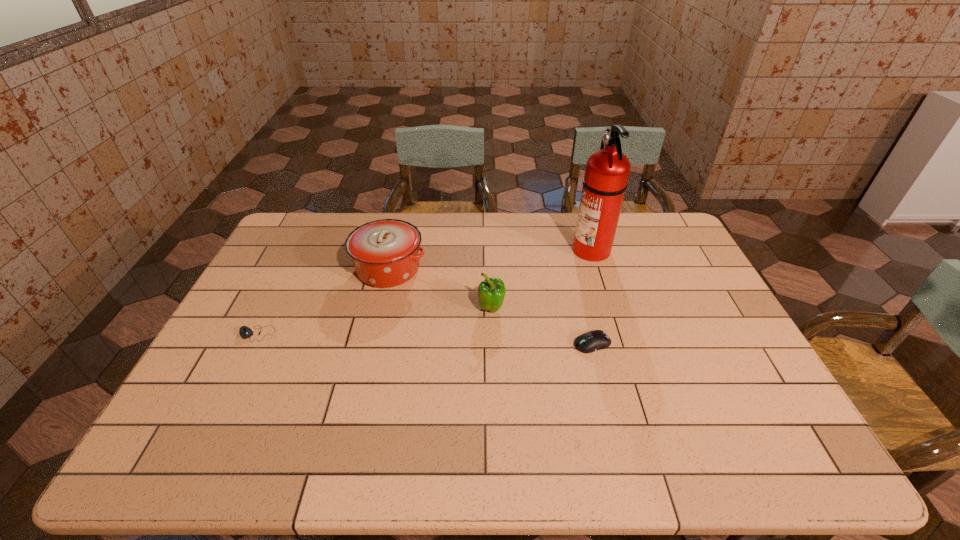
Locate an element on the screen. The height and width of the screenshot is (540, 960). the tallest object is located at coordinates (607, 171).

You are a GUI agent. You are given a task and a screenshot of the screen. Output one action in this format:
    pyautogui.click(x=<x>, y=<y>)
    Task: Click on the casserole
    
    Given the screenshot: What is the action you would take?
    pyautogui.click(x=385, y=253)

I want to click on the third nearest object, so 491,292.

Where is `the third object from right to left`? This screenshot has width=960, height=540. the third object from right to left is located at coordinates (491, 292).

I want to click on the second shortest object, so click(x=595, y=340).

Where is `the right computer mouse`? The image size is (960, 540). the right computer mouse is located at coordinates (595, 340).

At what (x,y) coordinates should I click in order to perform the action: click on the left computer mouse. Please return your answer as a coordinate pair (x, y). Looking at the image, I should click on (246, 332).

The image size is (960, 540). Identify the location of the shorter computer mouse. (246, 332).

This screenshot has height=540, width=960. What are the coordinates of `vacant space located 0.150m at the nozzle of the tallest object` in the screenshot? It's located at (530, 249).

Where is `vacant space situated at the nozzle of the tallest object`? This screenshot has height=540, width=960. vacant space situated at the nozzle of the tallest object is located at coordinates (530, 249).